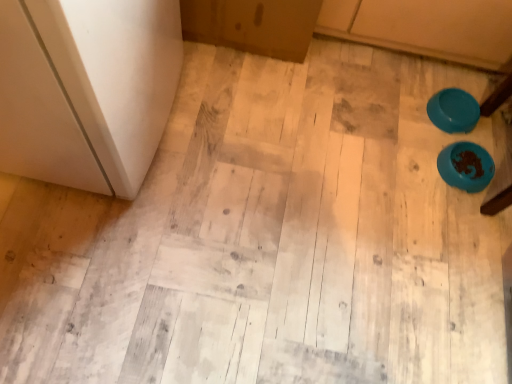
Locate an element on the screen. Image resolution: width=512 pixels, height=384 pixels. blue plastic bowl at lower right, the first bowl positioned from the bottom is located at coordinates (466, 166).

This screenshot has height=384, width=512. What do you see at coordinates (466, 166) in the screenshot?
I see `blue plastic bowl at lower right, which appears as the second bowl when viewed from the top` at bounding box center [466, 166].

What is the approximate height of blue plastic bowl at lower right, which appears as the second bowl when viewed from the top?

blue plastic bowl at lower right, which appears as the second bowl when viewed from the top, is 1.98 inches in height.

The height and width of the screenshot is (384, 512). What do you see at coordinates (453, 110) in the screenshot?
I see `teal glossy bowl at upper right, which is the 2th bowl in bottom-to-top order` at bounding box center [453, 110].

This screenshot has width=512, height=384. What are the coordinates of `teal glossy bowl at upper right, which is the 2th bowl in bottom-to-top order` in the screenshot? It's located at (453, 110).

Measure the distance between teal glossy bowl at upper right, which is the first bowl from top to bottom, and camera.

teal glossy bowl at upper right, which is the first bowl from top to bottom, is 4.74 feet away from camera.

You are a GUI agent. You are given a task and a screenshot of the screen. Output one action in this format:
    pyautogui.click(x=<x>, y=<y>)
    Task: Click on the blue plastic bowl at lower right, which appears as the second bowl when viewed from the top
    
    Given the screenshot: What is the action you would take?
    point(466,166)

Which is more to the left, blue plastic bowl at lower right, the first bowl positioned from the bottom, or teal glossy bowl at upper right, which is the first bowl from top to bottom?

teal glossy bowl at upper right, which is the first bowl from top to bottom.

Considering the relative positions of blue plastic bowl at lower right, the first bowl positioned from the bottom, and teal glossy bowl at upper right, which is the 2th bowl in bottom-to-top order, in the image provided, is blue plastic bowl at lower right, the first bowl positioned from the bottom, in front of teal glossy bowl at upper right, which is the 2th bowl in bottom-to-top order,?

Yes, blue plastic bowl at lower right, the first bowl positioned from the bottom, is closer to the camera.

Does point (488, 170) appear closer or farther from the camera than point (436, 113)?

Point (488, 170) is positioned closer to the camera compared to point (436, 113).

From the image's perspective, is blue plastic bowl at lower right, the first bowl positioned from the bottom, positioned above or below teal glossy bowl at upper right, which is the first bowl from top to bottom?

From the image's perspective, blue plastic bowl at lower right, the first bowl positioned from the bottom, appears below teal glossy bowl at upper right, which is the first bowl from top to bottom.

From a real-world perspective, who is located higher, blue plastic bowl at lower right, the first bowl positioned from the bottom, or teal glossy bowl at upper right, which is the 2th bowl in bottom-to-top order?

From a 3D spatial view, teal glossy bowl at upper right, which is the 2th bowl in bottom-to-top order, is above.

Does blue plastic bowl at lower right, which appears as the second bowl when viewed from the top, have a greater width compared to teal glossy bowl at upper right, which is the first bowl from top to bottom?

No, blue plastic bowl at lower right, which appears as the second bowl when viewed from the top, is not wider than teal glossy bowl at upper right, which is the first bowl from top to bottom.

Which of these two, blue plastic bowl at lower right, the first bowl positioned from the bottom, or teal glossy bowl at upper right, which is the first bowl from top to bottom, stands shorter?

teal glossy bowl at upper right, which is the first bowl from top to bottom.

Considering the relative sizes of blue plastic bowl at lower right, the first bowl positioned from the bottom, and teal glossy bowl at upper right, which is the first bowl from top to bottom, in the image provided, is blue plastic bowl at lower right, the first bowl positioned from the bottom, smaller than teal glossy bowl at upper right, which is the first bowl from top to bottom,?

No.

Is teal glossy bowl at upper right, which is the 2th bowl in bottom-to-top order, a part of blue plastic bowl at lower right, which appears as the second bowl when viewed from the top?

That's incorrect, teal glossy bowl at upper right, which is the 2th bowl in bottom-to-top order, is not inside blue plastic bowl at lower right, which appears as the second bowl when viewed from the top.

Is there a large distance between blue plastic bowl at lower right, which appears as the second bowl when viewed from the top, and teal glossy bowl at upper right, which is the first bowl from top to bottom?

No, blue plastic bowl at lower right, which appears as the second bowl when viewed from the top, is not far away from teal glossy bowl at upper right, which is the first bowl from top to bottom.

Is blue plastic bowl at lower right, which appears as the second bowl when viewed from the top, oriented away from teal glossy bowl at upper right, which is the 2th bowl in bottom-to-top order?

No, blue plastic bowl at lower right, which appears as the second bowl when viewed from the top, is not facing the opposite direction of teal glossy bowl at upper right, which is the 2th bowl in bottom-to-top order.

How different are the orientations of blue plastic bowl at lower right, the first bowl positioned from the bottom, and teal glossy bowl at upper right, which is the first bowl from top to bottom, in degrees?

They differ by 0.000693 degrees in their facing directions.

There is a blue plastic bowl at lower right, the first bowl positioned from the bottom. Identify the location of bowl above it (from a real-world perspective). This screenshot has width=512, height=384. click(453, 110).

Does teal glossy bowl at upper right, which is the 2th bowl in bottom-to-top order, appear on the left side of blue plastic bowl at lower right, which appears as the second bowl when viewed from the top?

Correct, you'll find teal glossy bowl at upper right, which is the 2th bowl in bottom-to-top order, to the left of blue plastic bowl at lower right, which appears as the second bowl when viewed from the top.

Relative to blue plastic bowl at lower right, which appears as the second bowl when viewed from the top, is teal glossy bowl at upper right, which is the first bowl from top to bottom, in front or behind?

In the image, teal glossy bowl at upper right, which is the first bowl from top to bottom, appears behind blue plastic bowl at lower right, which appears as the second bowl when viewed from the top.

Considering the points (451, 130) and (469, 164), which point is in front, point (451, 130) or point (469, 164)?

The point (469, 164) is closer.

Consider the image. From the image's perspective, which is below, teal glossy bowl at upper right, which is the first bowl from top to bottom, or blue plastic bowl at lower right, the first bowl positioned from the bottom?

blue plastic bowl at lower right, the first bowl positioned from the bottom, appears lower in the image.

From a real-world perspective, is teal glossy bowl at upper right, which is the first bowl from top to bottom, beneath blue plastic bowl at lower right, which appears as the second bowl when viewed from the top?

Actually, teal glossy bowl at upper right, which is the first bowl from top to bottom, is physically above blue plastic bowl at lower right, which appears as the second bowl when viewed from the top, in the real world.

In the scene shown: Considering the sizes of objects teal glossy bowl at upper right, which is the 2th bowl in bottom-to-top order, and blue plastic bowl at lower right, the first bowl positioned from the bottom, in the image provided, who is thinner, teal glossy bowl at upper right, which is the 2th bowl in bottom-to-top order, or blue plastic bowl at lower right, the first bowl positioned from the bottom,?

blue plastic bowl at lower right, the first bowl positioned from the bottom, is thinner.

Considering the sizes of teal glossy bowl at upper right, which is the first bowl from top to bottom, and blue plastic bowl at lower right, the first bowl positioned from the bottom, in the image, is teal glossy bowl at upper right, which is the first bowl from top to bottom, taller or shorter than blue plastic bowl at lower right, the first bowl positioned from the bottom,?

In the image, teal glossy bowl at upper right, which is the first bowl from top to bottom, appears to be shorter than blue plastic bowl at lower right, the first bowl positioned from the bottom.

Looking at the image, does teal glossy bowl at upper right, which is the 2th bowl in bottom-to-top order, seem bigger or smaller compared to blue plastic bowl at lower right, which appears as the second bowl when viewed from the top?

Clearly, teal glossy bowl at upper right, which is the 2th bowl in bottom-to-top order, is smaller in size than blue plastic bowl at lower right, which appears as the second bowl when viewed from the top.

Is teal glossy bowl at upper right, which is the first bowl from top to bottom, located outside blue plastic bowl at lower right, which appears as the second bowl when viewed from the top?

Yes, teal glossy bowl at upper right, which is the first bowl from top to bottom, is not within blue plastic bowl at lower right, which appears as the second bowl when viewed from the top.

Is teal glossy bowl at upper right, which is the 2th bowl in bottom-to-top order, positioned far away from blue plastic bowl at lower right, which appears as the second bowl when viewed from the top?

teal glossy bowl at upper right, which is the 2th bowl in bottom-to-top order, is actually quite close to blue plastic bowl at lower right, which appears as the second bowl when viewed from the top.

Does teal glossy bowl at upper right, which is the first bowl from top to bottom, turn towards blue plastic bowl at lower right, which appears as the second bowl when viewed from the top?

No, teal glossy bowl at upper right, which is the first bowl from top to bottom, is not oriented towards blue plastic bowl at lower right, which appears as the second bowl when viewed from the top.

Can you tell me how much teal glossy bowl at upper right, which is the first bowl from top to bottom, and blue plastic bowl at lower right, which appears as the second bowl when viewed from the top, differ in facing direction?

The facing directions of teal glossy bowl at upper right, which is the first bowl from top to bottom, and blue plastic bowl at lower right, which appears as the second bowl when viewed from the top, are 0.000693 degrees apart.

This screenshot has height=384, width=512. What are the coordinates of `bowl above the blue plastic bowl at lower right, which appears as the second bowl when viewed from the top (from the image's perspective)` in the screenshot? It's located at (453, 110).

Identify the location of bowl in front of the teal glossy bowl at upper right, which is the first bowl from top to bottom. The width and height of the screenshot is (512, 384). (466, 166).

This screenshot has width=512, height=384. I want to click on bowl behind the blue plastic bowl at lower right, the first bowl positioned from the bottom, so click(453, 110).